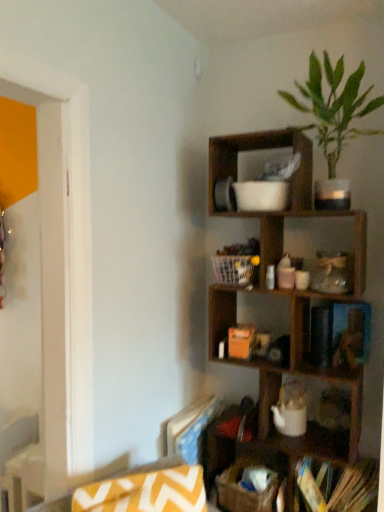
You are a GUI agent. You are given a task and a screenshot of the screen. Output one action in this format:
    pyautogui.click(x=<x>, y=<y>)
    Task: Click on the wooden shelf at upper right
    The width and height of the screenshot is (384, 512).
    Given the screenshot: What is the action you would take?
    pyautogui.click(x=294, y=296)

Describe the element at coordinates (243, 490) in the screenshot. I see `brown woven basket at lower center` at that location.

Measure the distance between yellow zigzag fabric swivel chair at lower left and camera.

yellow zigzag fabric swivel chair at lower left and camera are 3.93 feet apart.

Describe the element at coordinates (238, 264) in the screenshot. The width and height of the screenshot is (384, 512). I see `white plastic basket at center` at that location.

What do you see at coordinates (340, 487) in the screenshot? I see `hardcover books at lower right` at bounding box center [340, 487].

The width and height of the screenshot is (384, 512). I want to click on wooden shelf at upper right, so click(294, 296).

Is yellow zigzag fabric swivel chair at lower left completely or partially outside of brown woven basket at lower center?

yellow zigzag fabric swivel chair at lower left is positioned outside brown woven basket at lower center.

Is the position of yellow zigzag fabric swivel chair at lower left less distant than that of brown woven basket at lower center?

Yes, the depth of yellow zigzag fabric swivel chair at lower left is less than that of brown woven basket at lower center.

Considering the relative sizes of yellow zigzag fabric swivel chair at lower left and brown woven basket at lower center in the image provided, is yellow zigzag fabric swivel chair at lower left bigger than brown woven basket at lower center?

Indeed, yellow zigzag fabric swivel chair at lower left has a larger size compared to brown woven basket at lower center.

In the scene shown: From a real-world perspective, is yellow zigzag fabric swivel chair at lower left physically below brown woven basket at lower center?

Incorrect, from a real-world perspective, yellow zigzag fabric swivel chair at lower left is higher than brown woven basket at lower center.

Is the depth of green leafy plant at upper right less than that of hardcover books at lower right?

Yes, it is in front of hardcover books at lower right.

From a real-world perspective, is green leafy plant at upper right over hardcover books at lower right?

Yes.

Who is shorter, yellow zigzag fabric swivel chair at lower left or green leafy plant at upper right?

yellow zigzag fabric swivel chair at lower left.

Is yellow zigzag fabric swivel chair at lower left with green leafy plant at upper right?

yellow zigzag fabric swivel chair at lower left and green leafy plant at upper right are not in contact.

Is yellow zigzag fabric swivel chair at lower left outside of green leafy plant at upper right?

Indeed, yellow zigzag fabric swivel chair at lower left is completely outside green leafy plant at upper right.

Which object is further away from the camera, yellow zigzag fabric swivel chair at lower left or green leafy plant at upper right?

green leafy plant at upper right is behind.

In terms of height, does green leafy plant at upper right look taller or shorter compared to wooden shelf at upper right?

Considering their sizes, green leafy plant at upper right has less height than wooden shelf at upper right.

Does green leafy plant at upper right appear on the left side of wooden shelf at upper right?

No, green leafy plant at upper right is not to the left of wooden shelf at upper right.

Which is in front, point (357, 79) or point (270, 413)?

The point (357, 79) is in front.

Which of these two, green leafy plant at upper right or wooden shelf at upper right, is smaller?

green leafy plant at upper right is smaller.

Which is behind, point (256, 285) or point (310, 472)?

The point (256, 285) is more distant.

Looking at this image, is white plastic basket at center situated inside hardcover books at lower right or outside?

white plastic basket at center is not inside hardcover books at lower right, it's outside.

Considering the relative sizes of white plastic basket at center and hardcover books at lower right in the image provided, is white plastic basket at center shorter than hardcover books at lower right?

Correct, white plastic basket at center is not as tall as hardcover books at lower right.

From the image's perspective, is white plastic basket at center above hardcover books at lower right?

Yes, from the image's perspective, white plastic basket at center is over hardcover books at lower right.

Is hardcover books at lower right taller or shorter than green leafy plant at upper right?

Clearly, hardcover books at lower right is shorter compared to green leafy plant at upper right.

Can you see hardcover books at lower right touching green leafy plant at upper right?

No, hardcover books at lower right is not in contact with green leafy plant at upper right.

Looking at this image, from the image's perspective, which is below, hardcover books at lower right or green leafy plant at upper right?

hardcover books at lower right.

How far apart are hardcover books at lower right and green leafy plant at upper right?

hardcover books at lower right and green leafy plant at upper right are 1.37 meters apart.

This screenshot has height=512, width=384. I want to click on shelf on the right side of brown woven basket at lower center, so click(294, 296).

Which of these two, wooden shelf at upper right or brown woven basket at lower center, is bigger?

Bigger between the two is wooden shelf at upper right.

Would you consider wooden shelf at upper right to be distant from brown woven basket at lower center?

No, wooden shelf at upper right is not far away from brown woven basket at lower center.

From a real-world perspective, is wooden shelf at upper right below brown woven basket at lower center?

Incorrect, from a real-world perspective, wooden shelf at upper right is higher than brown woven basket at lower center.

You are a GUI agent. You are given a task and a screenshot of the screen. Output one action in this format:
    pyautogui.click(x=<x>, y=<y>)
    Task: Click on the swivel chair that appears above the brown woven basket at lower center (from a real-world perspective)
    The width and height of the screenshot is (384, 512).
    Given the screenshot: What is the action you would take?
    pyautogui.click(x=146, y=492)

Identify the location of book that appears behind the green leafy plant at upper right. (340, 487).

Estimate the real-world distances between objects in this image. Which object is further from wooden shelf at upper right, white plastic basket at center or brown woven basket at lower center?

brown woven basket at lower center is further to wooden shelf at upper right.

From the picture: Estimate the real-world distances between objects in this image. Which object is closer to wooden shelf at upper right, brown woven basket at lower center or hardcover books at lower right?

The object closer to wooden shelf at upper right is hardcover books at lower right.

Which object lies nearer to the anchor point wooden shelf at upper right, green leafy plant at upper right or white plastic basket at center?

white plastic basket at center is closer to wooden shelf at upper right.

Based on their spatial positions, is brown woven basket at lower center or yellow zigzag fabric swivel chair at lower left closer to hardcover books at lower right?

The object closer to hardcover books at lower right is brown woven basket at lower center.

Considering their positions, is yellow zigzag fabric swivel chair at lower left positioned further to white plastic basket at center than wooden shelf at upper right?

yellow zigzag fabric swivel chair at lower left.

When comparing their distances from brown woven basket at lower center, does hardcover books at lower right or white plastic basket at center seem closer?

hardcover books at lower right lies closer to brown woven basket at lower center than the other object.

Estimate the real-world distances between objects in this image. Which object is closer to white plastic basket at center, yellow zigzag fabric swivel chair at lower left or hardcover books at lower right?

yellow zigzag fabric swivel chair at lower left is positioned closer to the anchor white plastic basket at center.

Looking at this image, considering their positions, is wooden shelf at upper right positioned closer to yellow zigzag fabric swivel chair at lower left than hardcover books at lower right?

hardcover books at lower right is positioned closer to the anchor yellow zigzag fabric swivel chair at lower left.

You are a GUI agent. You are given a task and a screenshot of the screen. Output one action in this format:
    pyautogui.click(x=<x>, y=<y>)
    Task: Click on the swivel chair that lies between white plastic basket at center and brown woven basket at lower center from top to bottom
    The height and width of the screenshot is (512, 384).
    Given the screenshot: What is the action you would take?
    pyautogui.click(x=146, y=492)

Where is `shelf between green leafy plant at upper right and brown woven basket at lower center in the up-down direction`? shelf between green leafy plant at upper right and brown woven basket at lower center in the up-down direction is located at coordinates (294, 296).

Locate an element on the screen. shelf between white plastic basket at center and brown woven basket at lower center vertically is located at coordinates coord(294,296).

Locate an element on the screen. The width and height of the screenshot is (384, 512). cabinet that lies between green leafy plant at upper right and hardcover books at lower right from top to bottom is located at coordinates (238, 264).